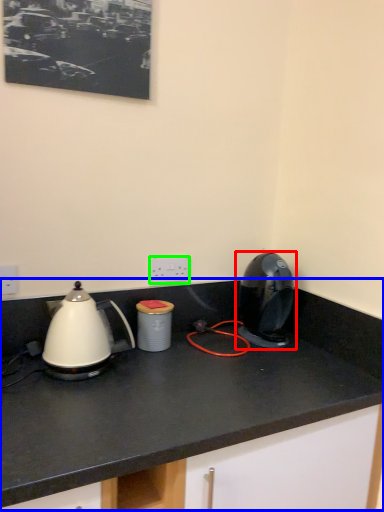
Question: Considering the real-world distances, which object is farthest from home appliance (highlighted by a red box)? countertop (highlighted by a blue box) or electric outlet (highlighted by a green box)?

Choices:
 (A) countertop
 (B) electric outlet

Answer: (B)